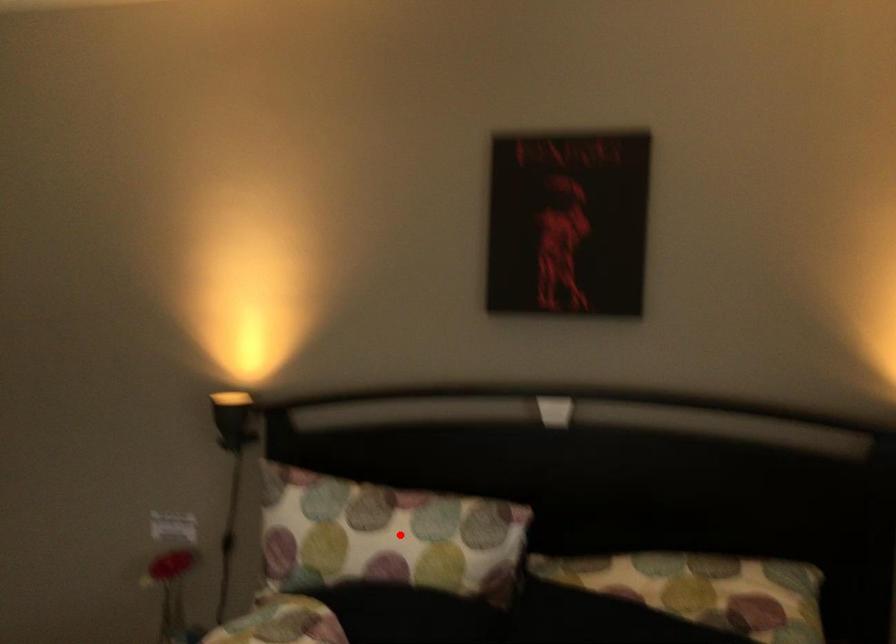
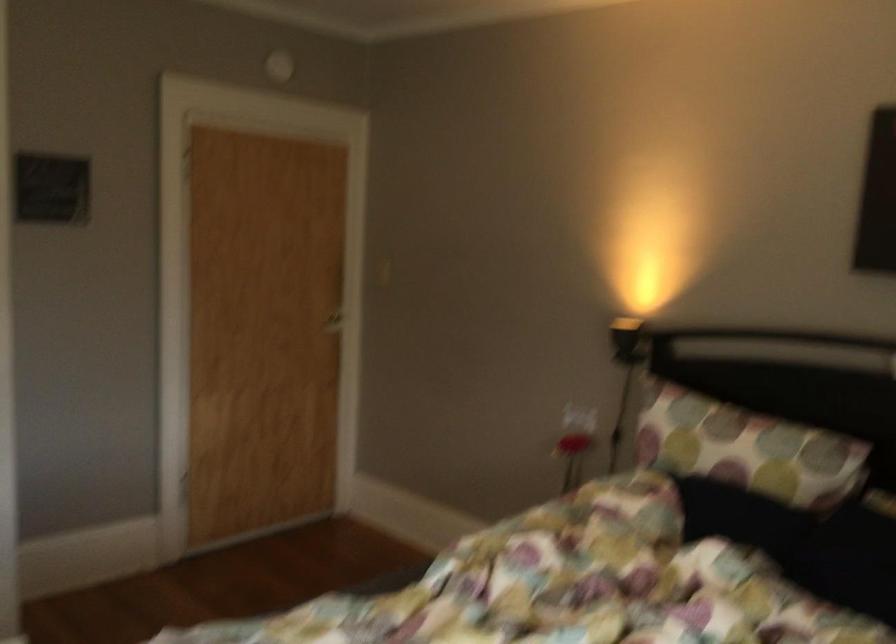
Question: I am providing you with two images of the same scene from different viewpoints. A red point is marked on the first image. At the location where the point appears in image 1, is it still visible in image 2?

Choices:
 (A) Yes
 (B) No

Answer: (A)